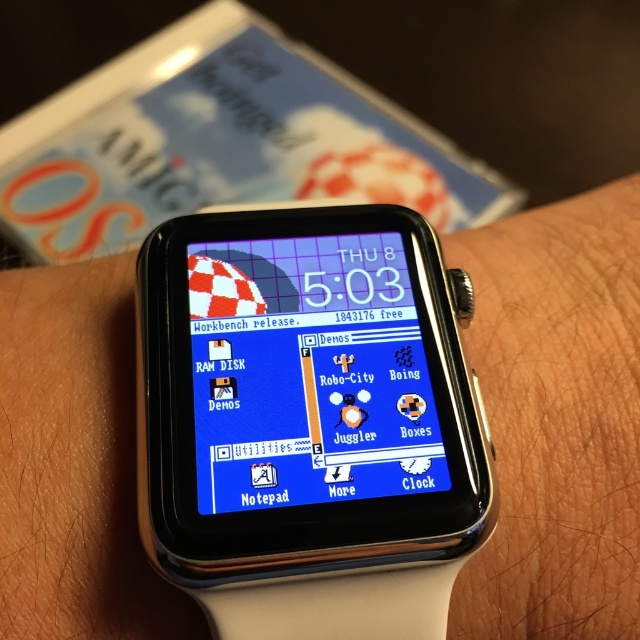
Consider the image. You are trying to determine which object is closer to you in the image. Which is closer, the satin black watch at center or the blue glossy watch face at center?

The satin black watch at center is closer to you because it is in front of the blue glossy watch face at center.

You are trying to determine the spatial relationship between the satin black watch at center and the blue glossy watch face at center. Which object is taller?

The satin black watch at center is much taller than the blue glossy watch face at center.

You are looking at a smartwatch and notice two main components, the satin black watch at center and the blue glossy watch face at center. From the perspective of someone holding the watch, which component is positioned lower on the wrist?

The satin black watch at center is located below the blue glossy watch face at center, so the satin black watch at center is positioned lower on the wrist.